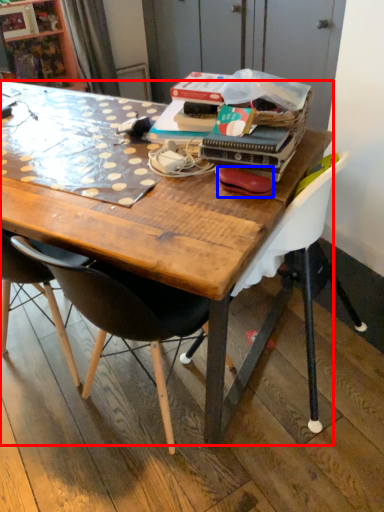
Question: Which point is closer to the camera, desk (highlighted by a red box) or handbag (highlighted by a blue box)?

Choices:
 (A) desk
 (B) handbag

Answer: (A)